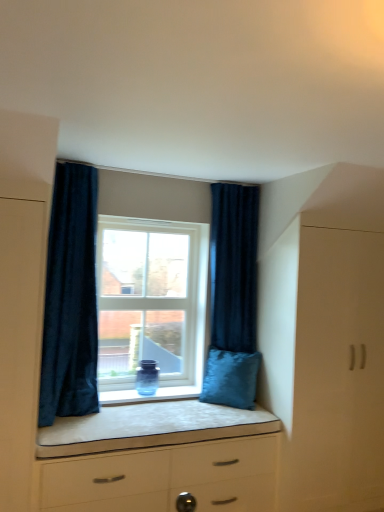
Question: In terms of height, does dark blue velvet curtain at right, which is the second curtain from front to back, look taller or shorter compared to dark blue velvet curtain at left, which is the 2th curtain from right to left?

Choices:
 (A) tall
 (B) short

Answer: (B)

Question: From a real-world perspective, relative to dark blue velvet curtain at left, which is the 2th curtain from right to left, is dark blue velvet curtain at right, which is the second curtain from front to back, vertically above or below?

Choices:
 (A) below
 (B) above

Answer: (B)

Question: Based on their relative distances, which object is farther from the white matte cabinet at right?

Choices:
 (A) dark blue velvet curtain at left, which is the 2th curtain from right to left
 (B) white glossy chest of drawers at center
 (C) velvet blue pillow at lower right
 (D) clear glass window at center
 (E) dark blue velvet curtain at right, the 1th curtain positioned from the right

Answer: (A)

Question: Which of these objects is positioned farthest from the white matte cabinet at right?

Choices:
 (A) clear glass window at center
 (B) white glossy chest of drawers at center
 (C) dark blue velvet curtain at right, which is the second curtain from front to back
 (D) dark blue velvet curtain at left, which is the first curtain from left to right
 (E) velvet blue pillow at lower right

Answer: (D)